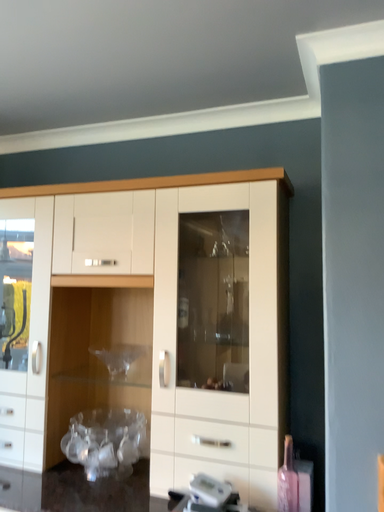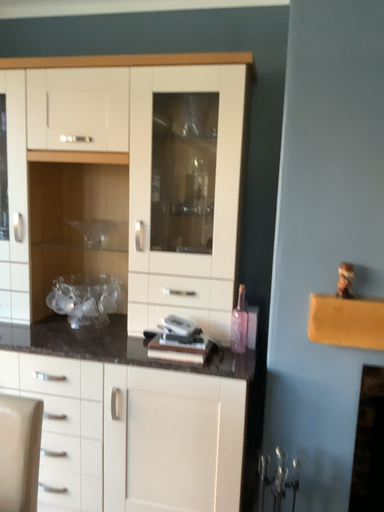
Question: Which way did the camera rotate in the video?

Choices:
 (A) rotated downward
 (B) rotated upward

Answer: (A)